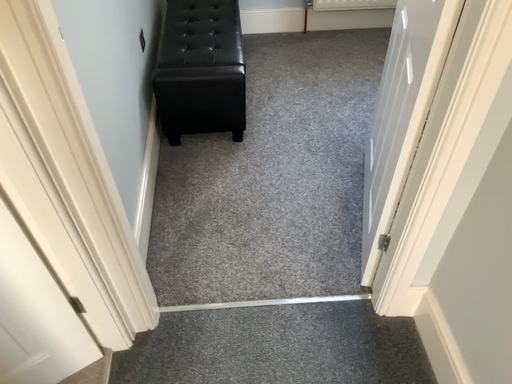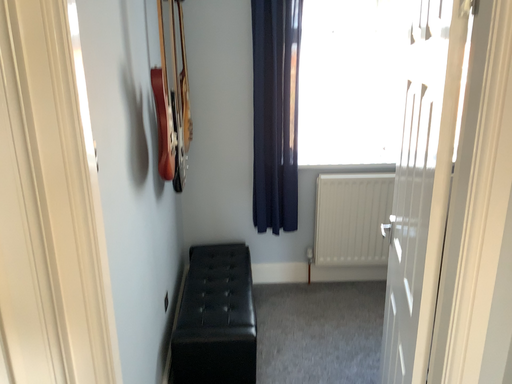
Question: How did the camera likely rotate when shooting the video?

Choices:
 (A) rotated upward
 (B) rotated downward

Answer: (A)